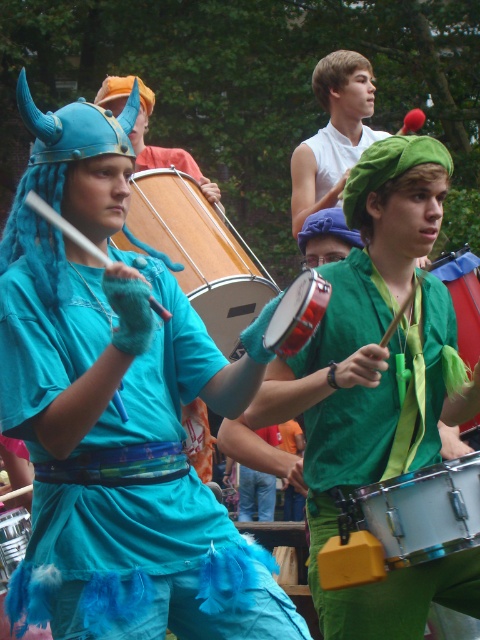
You are standing at the point marked as point (206, 253). If you walk straight ahead, will you eventually see the blue viking warrior on the left?

The distance of point (206, 253) from viewer is 25.34 feet, so if you walk straight ahead from point (206, 253), you will eventually see the blue viking warrior on the left as the distance is within a visible range.

You are a participant in the parade and need to choose a drum to carry. The wooden drum at center and the shiny red drum at center are available. Which drum should you choose if you want the larger one?

The wooden drum at center is bigger than the shiny red drum at center, so you should choose the wooden drum at center.

You are a photographer standing in the middle of the parade. You see the white smooth shirt at upper center and the brushed metal drum at lower left. Which object is higher in the image?

The white smooth shirt at upper center is located above the brushed metal drum at lower left, so it is higher in the image.